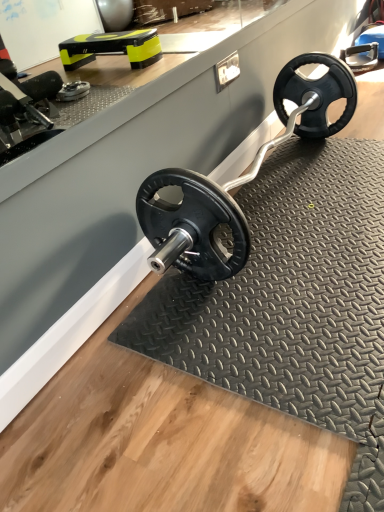
Identify the location of free space underneath black rubber weight plate at center (from a real-world perspective). The width and height of the screenshot is (384, 512). (279, 184).